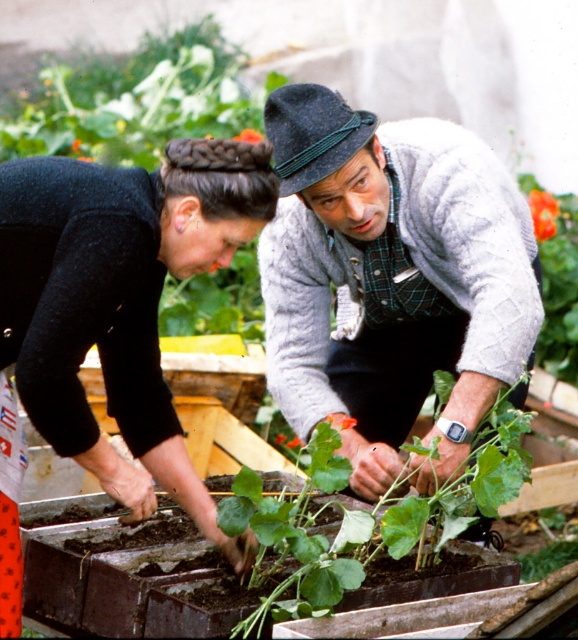
Question: Among these objects, which one is farthest from the camera?

Choices:
 (A) orange matte flower at upper center
 (B) gray wool sweater at center
 (C) orange matte flower at upper right
 (D) orange matte flower at center

Answer: (A)

Question: Which of the following is the closest to the observer?

Choices:
 (A) (368, 554)
 (B) (546, 205)

Answer: (A)

Question: Does green leafy plant at center come in front of orange matte flower at center?

Choices:
 (A) yes
 (B) no

Answer: (A)

Question: Is orange flower at upper right to the left of orange matte flower at center from the viewer's perspective?

Choices:
 (A) yes
 (B) no

Answer: (B)

Question: Which point is farther from the camera taking this photo?

Choices:
 (A) (521, 483)
 (B) (69, 400)
 (C) (336, 429)

Answer: (C)

Question: From the image, what is the correct spatial relationship of black velvet hair at center in relation to orange matte flower at upper right?

Choices:
 (A) above
 (B) below

Answer: (B)